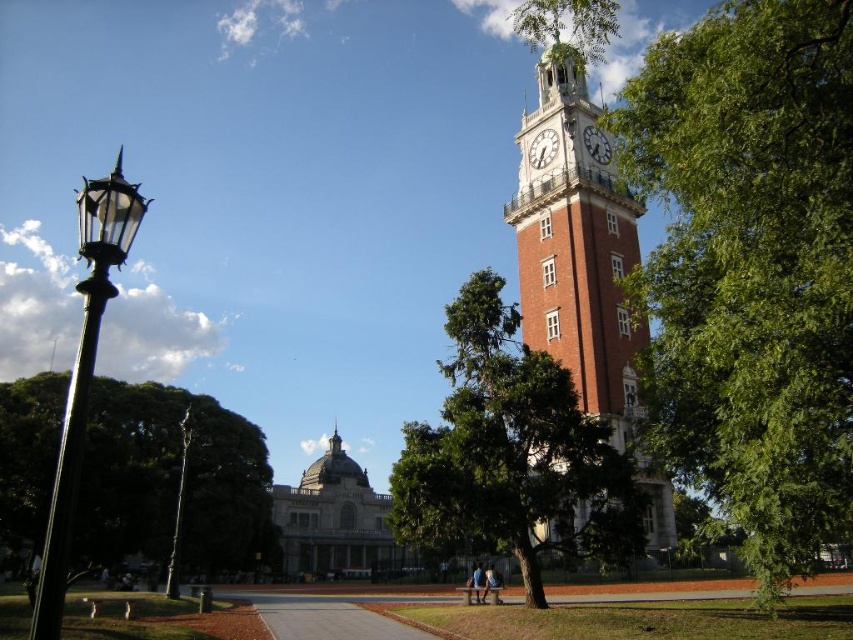
You are standing at the lamppost with a classic design on the left side of the image. You want to walk towards the clock tower on the right side. Which point, point (479, 308) or point (171, 586), would you pass first?

You would pass point (479, 308) first because it is in front of point (171, 586) along your path towards the clock tower.

You are a city planner assessing the urban layout. You need to determine if the green leafy tree at right can be moved closer to the black glass lamp post at left without obstructing the lamp post. Based on their current spatial relationship, what is your recommendation?

The green leafy tree at right occupies less space than the black glass lamp post at left, so moving the tree closer might be feasible as it takes up less area. However, ensure there is enough space between them to avoid obstruction.